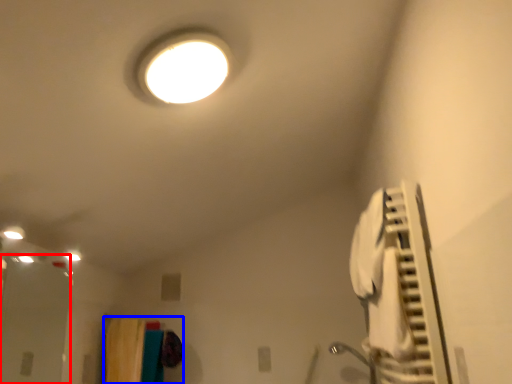
Question: Which of the following is the farthest to the observer, glass door (highlighted by a red box) or laundry (highlighted by a blue box)?

Choices:
 (A) glass door
 (B) laundry

Answer: (B)